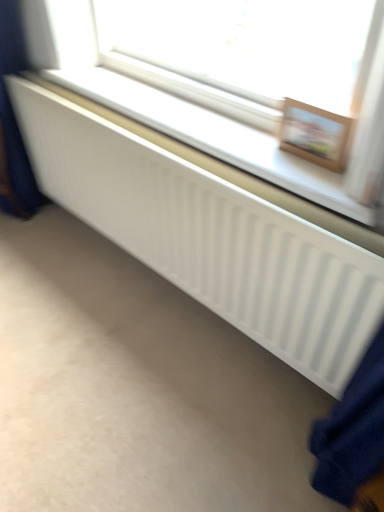
The image size is (384, 512). What are the coordinates of `vacant space situated above white matte radiator at center (from a real-world perspective)` in the screenshot? It's located at (194, 120).